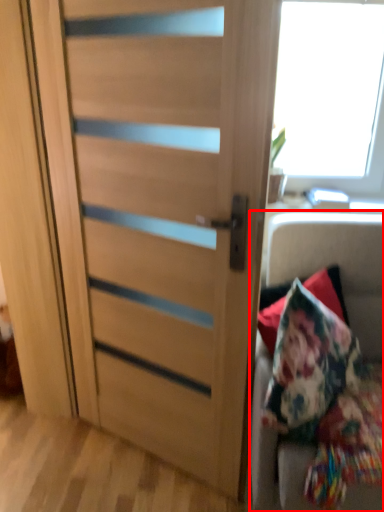
Question: Observing the image, what is the correct spatial positioning of furniture (annotated by the red box) in reference to door?

Choices:
 (A) left
 (B) right

Answer: (B)